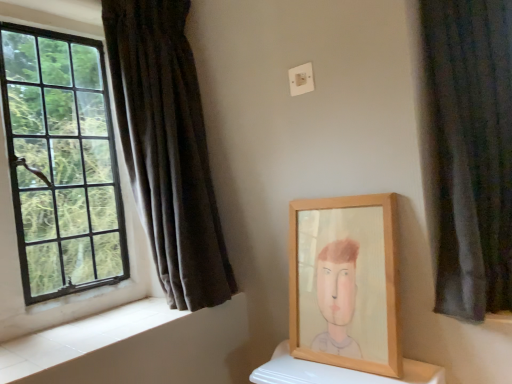
Question: Can you confirm if dark velvet curtain at right, arranged as the 1th curtain when viewed from the front, is shorter than black glass window at left?

Choices:
 (A) yes
 (B) no

Answer: (A)

Question: From the image's perspective, is dark velvet curtain at right, arranged as the 1th curtain when viewed from the front, under black glass window at left?

Choices:
 (A) yes
 (B) no

Answer: (B)

Question: Is dark velvet curtain at right, the 2th curtain in the left-to-right sequence, to the right of black glass window at left from the viewer's perspective?

Choices:
 (A) no
 (B) yes

Answer: (B)

Question: From a real-world perspective, is dark velvet curtain at right, which is the 2th curtain in back-to-front order, below black glass window at left?

Choices:
 (A) yes
 (B) no

Answer: (A)

Question: Considering the relative sizes of dark velvet curtain at right, which is the 2th curtain in back-to-front order, and black glass window at left in the image provided, is dark velvet curtain at right, which is the 2th curtain in back-to-front order, wider than black glass window at left?

Choices:
 (A) yes
 (B) no

Answer: (A)

Question: Is dark velvet curtain at right, the 2th curtain in the left-to-right sequence, in contact with black glass window at left?

Choices:
 (A) yes
 (B) no

Answer: (B)

Question: Is black glass window at left oriented away from dark velvet curtain at left, the 1th curtain from the back?

Choices:
 (A) yes
 (B) no

Answer: (A)

Question: From the image's perspective, is black glass window at left below dark velvet curtain at left, the 1th curtain from the back?

Choices:
 (A) no
 (B) yes

Answer: (B)

Question: Can you confirm if black glass window at left is wider than dark velvet curtain at left, the 1th curtain from the back?

Choices:
 (A) yes
 (B) no

Answer: (B)

Question: From a real-world perspective, does black glass window at left sit lower than dark velvet curtain at left, the 2th curtain in the right-to-left sequence?

Choices:
 (A) yes
 (B) no

Answer: (B)

Question: Is black glass window at left closer to camera compared to dark velvet curtain at left, which appears as the 2th curtain when viewed from the front?

Choices:
 (A) no
 (B) yes

Answer: (B)

Question: Does black glass window at left appear on the left side of dark velvet curtain at left, the 2th curtain in the right-to-left sequence?

Choices:
 (A) no
 (B) yes

Answer: (B)

Question: Does dark velvet curtain at right, the 1th curtain when ordered from right to left, have a greater width compared to wooden frame at center?

Choices:
 (A) no
 (B) yes

Answer: (B)